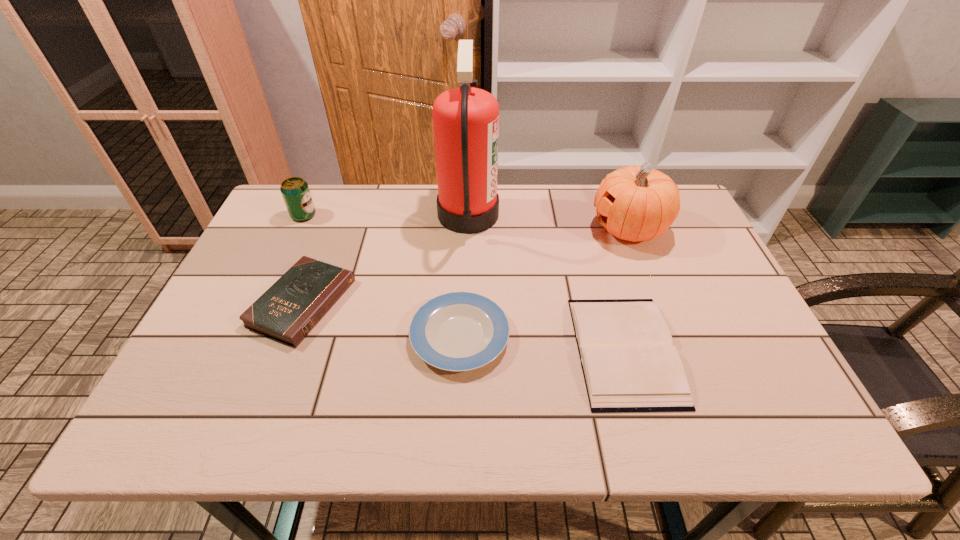
You are a GUI agent. You are given a task and a screenshot of the screen. Output one action in this format:
    pyautogui.click(x=<x>, y=<y>)
    Task: Click on the free space between the pumpkin and the tallest object
    The image size is (960, 540).
    Given the screenshot: What is the action you would take?
    pyautogui.click(x=549, y=221)

You are a GUI agent. You are given a task and a screenshot of the screen. Output one action in this format:
    pyautogui.click(x=<x>, y=<y>)
    Task: Click on the vacant area that lies between the hardback book and the fire extinguisher
    The width and height of the screenshot is (960, 540).
    Given the screenshot: What is the action you would take?
    pyautogui.click(x=546, y=282)

This screenshot has width=960, height=540. I want to click on free space that is in between the pumpkin and the Bible, so click(466, 266).

Locate an element on the screen. The height and width of the screenshot is (540, 960). free space between the pumpkin and the Bible is located at coordinates (466, 266).

Find the location of a particular element. free space between the fourth shortest object and the plate is located at coordinates (382, 275).

The image size is (960, 540). I want to click on unoccupied area between the second tallest object and the fire extinguisher, so click(549, 221).

Find the location of a particular element. The height and width of the screenshot is (540, 960). free point between the tallest object and the fourth shortest object is located at coordinates (386, 215).

Where is `vacant area between the beer can and the hardback book`? The image size is (960, 540). vacant area between the beer can and the hardback book is located at coordinates (465, 283).

The height and width of the screenshot is (540, 960). What are the coordinates of `blank region between the fire extinguisher and the plate` in the screenshot? It's located at (464, 275).

What are the coordinates of `free point between the beer can and the hardback book` in the screenshot? It's located at (465, 283).